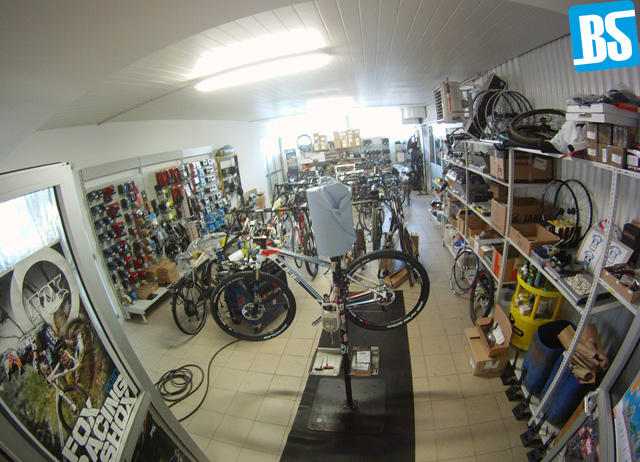
At what (x,y) coordinates should I click in order to perform the action: click on handle. Please return your answer as a coordinate pair (x, y). Looking at the image, I should click on (586, 399).